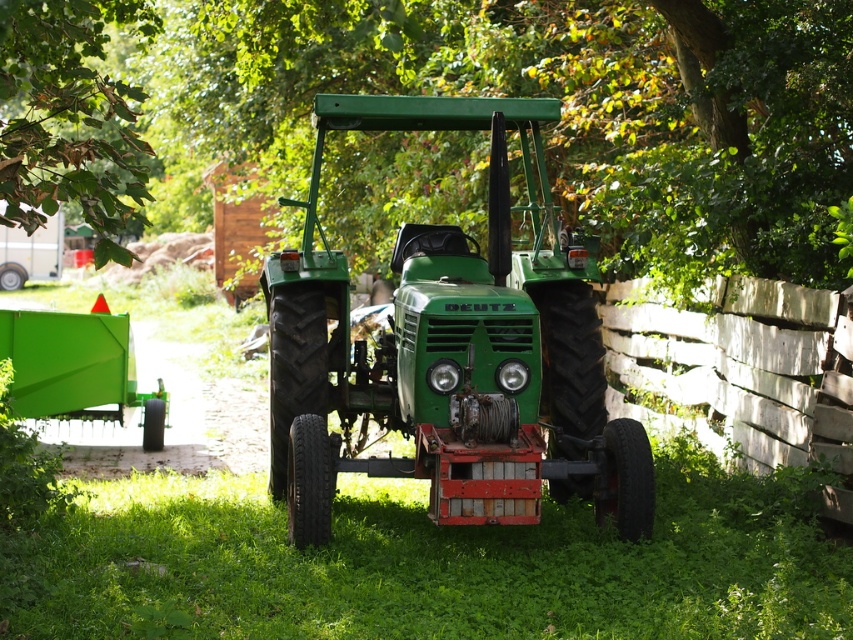
Can you confirm if green leafy tree at upper center is positioned to the right of green leafy tree at upper left?

Indeed, green leafy tree at upper center is positioned on the right side of green leafy tree at upper left.

Is point (128, 152) farther from camera compared to point (107, 122)?

That is False.

Who is more forward, (796, 275) or (100, 138)?

Point (796, 275) is in front.

Where is `green leafy tree at upper center`? Image resolution: width=853 pixels, height=640 pixels. green leafy tree at upper center is located at coordinates (460, 93).

Does green leafy tree at upper center appear over green matte tractor at center?

Yes, green leafy tree at upper center is above green matte tractor at center.

Does point (758, 72) lie behind point (459, 502)?

That is True.

This screenshot has width=853, height=640. Find the location of `green leafy tree at upper center`. green leafy tree at upper center is located at coordinates (460, 93).

Does green grass at center appear on the left side of green matte tractor at center?

Indeed, green grass at center is positioned on the left side of green matte tractor at center.

Between point (683, 474) and point (519, 269), which one is positioned in front?

Point (519, 269) is in front.

Where is `green grass at center`? green grass at center is located at coordinates (428, 563).

Where is `green grass at center`? green grass at center is located at coordinates (428, 563).